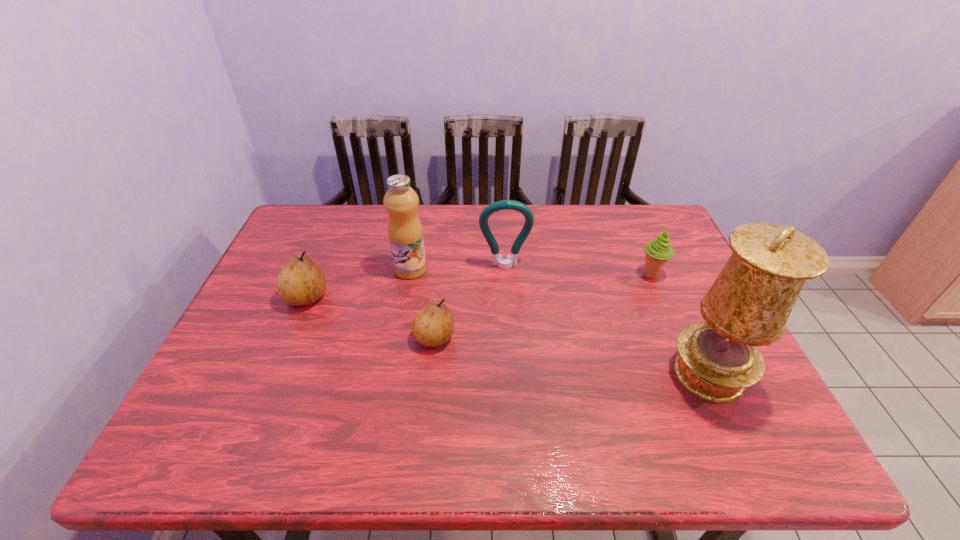
In the image, there is a desktop. In order to click on vacant space at the far edge in this screenshot , I will do `click(584, 239)`.

Where is `vacant space at the near edge of the desktop`? This screenshot has height=540, width=960. vacant space at the near edge of the desktop is located at coordinates (645, 392).

In the image, there is a desktop. Where is `vacant space at the left edge`? Image resolution: width=960 pixels, height=540 pixels. vacant space at the left edge is located at coordinates (262, 309).

Find the location of a particular element. The height and width of the screenshot is (540, 960). free space at the right edge of the desktop is located at coordinates (687, 310).

In the image, there is a desktop. In order to click on free space at the far left corner in this screenshot , I will do `click(327, 208)`.

Find the location of `free space at the near left corner of the desktop`. free space at the near left corner of the desktop is located at coordinates (217, 388).

The height and width of the screenshot is (540, 960). I want to click on vacant region between the shortest object and the leftmost object, so click(x=371, y=318).

The height and width of the screenshot is (540, 960). I want to click on vacant area that lies between the farther pear and the shorter pear, so click(371, 318).

You are a GUI agent. You are given a task and a screenshot of the screen. Output one action in this format:
    pyautogui.click(x=<x>, y=<y>)
    Task: Click on the free space between the fourth object from left to right and the icecream
    The width and height of the screenshot is (960, 540).
    Given the screenshot: What is the action you would take?
    pyautogui.click(x=578, y=271)

In order to click on unoccupied area between the fourth shortest object and the fruit juice in this screenshot , I will do `click(458, 268)`.